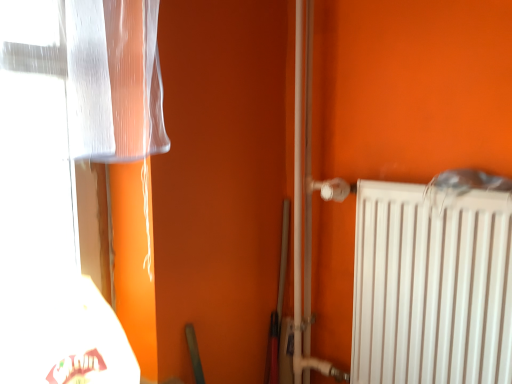
The height and width of the screenshot is (384, 512). Describe the element at coordinates (431, 286) in the screenshot. I see `white matte radiator at right` at that location.

Find the location of a particular element. This screenshot has width=512, height=384. white matte radiator at right is located at coordinates (431, 286).

The width and height of the screenshot is (512, 384). In order to click on white matte radiator at right in this screenshot , I will do `click(431, 286)`.